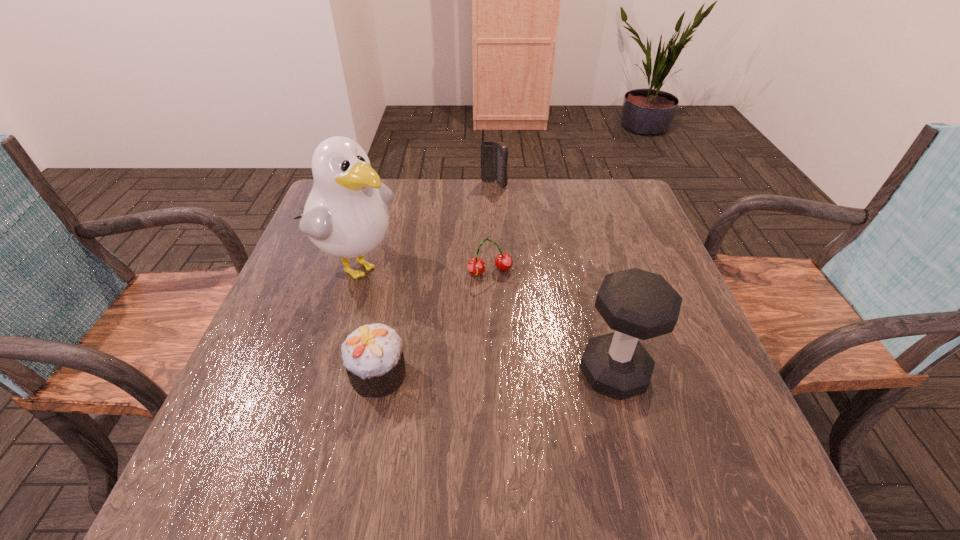
Find the location of `vacant space located on the beak of the gull`. vacant space located on the beak of the gull is located at coordinates (403, 298).

What are the coordinates of `free space located 0.070m on the beak of the gull` in the screenshot? It's located at (406, 300).

In order to click on vacant space situated on the keyboard of the third tallest object in this screenshot , I will do `click(493, 210)`.

Find the location of a particular element. free spot located 0.140m on the keyboard of the third tallest object is located at coordinates (492, 216).

You are a GUI agent. You are given a task and a screenshot of the screen. Output one action in this format:
    pyautogui.click(x=<x>, y=<y>)
    Task: Click on the vacant area situated 0.110m on the keyboard of the third tallest object
    The height and width of the screenshot is (540, 960).
    Given the screenshot: What is the action you would take?
    pyautogui.click(x=493, y=210)

The height and width of the screenshot is (540, 960). What are the coordinates of `vacant space located 0.220m with stems pointing upwards on the cherry` in the screenshot? It's located at (522, 354).

The height and width of the screenshot is (540, 960). I want to click on vacant region located 0.230m with stems pointing upwards on the cherry, so click(524, 359).

Find the location of a particular element. The width and height of the screenshot is (960, 540). blank space located 0.250m with stems pointing upwards on the cherry is located at coordinates (527, 367).

Identify the location of object located in the far edge section of the desktop. The width and height of the screenshot is (960, 540). (494, 156).

At what (x,y) coordinates should I click in order to perform the action: click on cupcake that is at the near edge. Please return your answer as a coordinate pair (x, y). The width and height of the screenshot is (960, 540). Looking at the image, I should click on (373, 356).